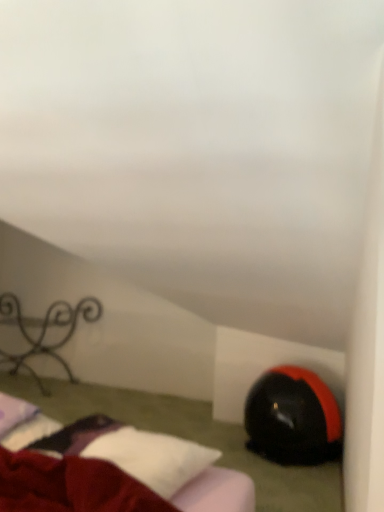
Question: From a real-world perspective, is black matte bean bag chair at lower right above or below iron wrought iron at left?

Choices:
 (A) above
 (B) below

Answer: (B)

Question: In terms of width, does black matte bean bag chair at lower right look wider or thinner when compared to iron wrought iron at left?

Choices:
 (A) wide
 (B) thin

Answer: (A)

Question: Based on their relative distances, which object is nearer to the iron wrought iron at left?

Choices:
 (A) velvet red bed at lower left
 (B) black matte bean bag chair at lower right

Answer: (B)

Question: Which object is the closest to the iron wrought iron at left?

Choices:
 (A) velvet red bed at lower left
 (B) black matte bean bag chair at lower right

Answer: (B)